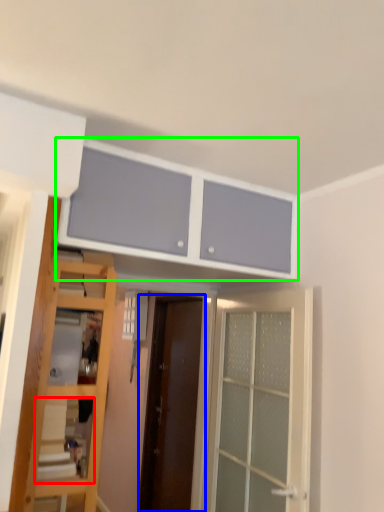
Question: Which is farther away from shelf (highlighted by a red box)? door (highlighted by a blue box) or cabinetry (highlighted by a green box)?

Choices:
 (A) door
 (B) cabinetry

Answer: (A)